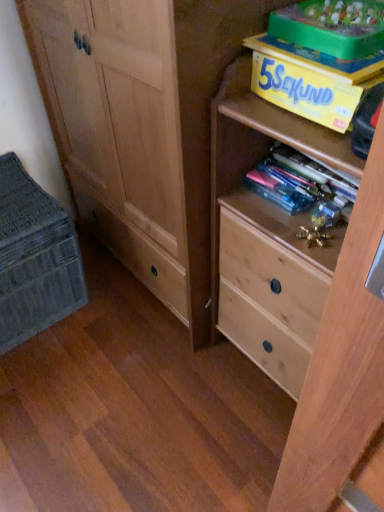
Find the location of a particular element. woven fabric basket at lower left is located at coordinates (34, 258).

Find the location of a particular element. translucent plastic books at center, which is counted as the 2th book, starting from the top is located at coordinates (303, 187).

The height and width of the screenshot is (512, 384). What do you see at coordinates (318, 59) in the screenshot?
I see `yellow cardboard box at upper right, acting as the first book starting from the top` at bounding box center [318, 59].

This screenshot has width=384, height=512. Identify the location of light wood chest of drawers at right. (301, 298).

Locate an element on the screen. The height and width of the screenshot is (512, 384). woven fabric basket at lower left is located at coordinates (34, 258).

How distant is yellow cardboard box at upper right, acting as the first book starting from the top, from green plastic storage box at upper right?

A distance of 1.88 inches exists between yellow cardboard box at upper right, acting as the first book starting from the top, and green plastic storage box at upper right.

Between yellow cardboard box at upper right, which is the 2th book from bottom to top, and green plastic storage box at upper right, which one is positioned behind?

Positioned behind is yellow cardboard box at upper right, which is the 2th book from bottom to top.

Does yellow cardboard box at upper right, which is the 2th book from bottom to top, appear on the left side of green plastic storage box at upper right?

Incorrect, yellow cardboard box at upper right, which is the 2th book from bottom to top, is not on the left side of green plastic storage box at upper right.

Could green plastic storage box at upper right be considered to be inside yellow cardboard box at upper right, which is the 2th book from bottom to top?

No, green plastic storage box at upper right is not a part of yellow cardboard box at upper right, which is the 2th book from bottom to top.

Which object is positioned more to the left, yellow cardboard box at upper right, which is the 2th book from bottom to top, or woven fabric basket at lower left?

Positioned to the left is woven fabric basket at lower left.

Does yellow cardboard box at upper right, which is the 2th book from bottom to top, contain woven fabric basket at lower left?

Actually, woven fabric basket at lower left is outside yellow cardboard box at upper right, which is the 2th book from bottom to top.

Is yellow cardboard box at upper right, acting as the first book starting from the top, positioned before woven fabric basket at lower left?

Yes, it is.

Is yellow cardboard box at upper right, acting as the first book starting from the top, turned away from woven fabric basket at lower left?

yellow cardboard box at upper right, acting as the first book starting from the top, is not turned away from woven fabric basket at lower left.

From a real-world perspective, does green plastic storage box at upper right sit lower than woven fabric basket at lower left?

No, from a real-world perspective, green plastic storage box at upper right is not below woven fabric basket at lower left.

How much distance is there between green plastic storage box at upper right and woven fabric basket at lower left?

green plastic storage box at upper right and woven fabric basket at lower left are 38.30 inches apart.

How different are the orientations of green plastic storage box at upper right and woven fabric basket at lower left in degrees?

green plastic storage box at upper right and woven fabric basket at lower left are facing 89.8 degrees away from each other.

Is green plastic storage box at upper right far from woven fabric basket at lower left?

No, there isn't a large distance between green plastic storage box at upper right and woven fabric basket at lower left.

Which is nearer, (332, 24) or (335, 450)?

The point (335, 450) is more forward.

Is green plastic storage box at upper right touching light wood chest of drawers at right?

No, green plastic storage box at upper right is not in contact with light wood chest of drawers at right.

From the image's perspective, which object appears higher, green plastic storage box at upper right or light wood chest of drawers at right?

green plastic storage box at upper right, from the image's perspective.

From a real-world perspective, is green plastic storage box at upper right physically above light wood chest of drawers at right?

Yes, from a real-world perspective, green plastic storage box at upper right is over light wood chest of drawers at right

How many degrees apart are the facing directions of light wood chest of drawers at right and green plastic storage box at upper right?

The angle between the facing direction of light wood chest of drawers at right and the facing direction of green plastic storage box at upper right is 0.9 degrees.

Looking at this image, considering the positions of objects light wood chest of drawers at right and green plastic storage box at upper right in the image provided, who is in front, light wood chest of drawers at right or green plastic storage box at upper right?

light wood chest of drawers at right is closer to the camera.

Who is bigger, light wood chest of drawers at right or green plastic storage box at upper right?

light wood chest of drawers at right.

Looking at their sizes, would you say light wood chest of drawers at right is wider or thinner than green plastic storage box at upper right?

light wood chest of drawers at right is wider than green plastic storage box at upper right.

Is green plastic storage box at upper right to the left of yellow cardboard box at upper right, acting as the first book starting from the top, from the viewer's perspective?

Yes, green plastic storage box at upper right is to the left of yellow cardboard box at upper right, acting as the first book starting from the top.

Between green plastic storage box at upper right and yellow cardboard box at upper right, which is the 2th book from bottom to top, which one has larger size?

With larger size is green plastic storage box at upper right.

In the scene shown: Would you say green plastic storage box at upper right is a long distance from yellow cardboard box at upper right, acting as the first book starting from the top?

green plastic storage box at upper right is near yellow cardboard box at upper right, acting as the first book starting from the top, not far away.

Does green plastic storage box at upper right turn towards yellow cardboard box at upper right, acting as the first book starting from the top?

No, green plastic storage box at upper right is not turned towards yellow cardboard box at upper right, acting as the first book starting from the top.

Is translucent plastic books at center, placed as the 1th book when sorted from bottom to top, facing towards light wood chest of drawers at right?

Yes, translucent plastic books at center, placed as the 1th book when sorted from bottom to top, is oriented towards light wood chest of drawers at right.

From a real-world perspective, which object stands above the other?

From a 3D spatial view, translucent plastic books at center, placed as the 1th book when sorted from bottom to top, is above.

From the picture: Are translucent plastic books at center, which is counted as the 2th book, starting from the top, and light wood chest of drawers at right far apart?

No, there isn't a large distance between translucent plastic books at center, which is counted as the 2th book, starting from the top, and light wood chest of drawers at right.

Is translucent plastic books at center, which is counted as the 2th book, starting from the top, surrounding light wood chest of drawers at right?

That's incorrect, light wood chest of drawers at right is not inside translucent plastic books at center, which is counted as the 2th book, starting from the top.

What are the coordinates of `book on the right of green plastic storage box at upper right` in the screenshot? It's located at (318, 59).

Image resolution: width=384 pixels, height=512 pixels. I want to click on the 2nd book in front of the woven fabric basket at lower left, so click(x=318, y=59).

Considering their positions, is translucent plastic books at center, which is counted as the 2th book, starting from the top, positioned closer to woven fabric basket at lower left than green plastic storage box at upper right?

Based on the image, translucent plastic books at center, which is counted as the 2th book, starting from the top, appears to be nearer to woven fabric basket at lower left.

Estimate the real-world distances between objects in this image. Which object is further from green plastic storage box at upper right, yellow cardboard box at upper right, which is the 2th book from bottom to top, or woven fabric basket at lower left?

woven fabric basket at lower left.

Based on their spatial positions, is light wood chest of drawers at right or green plastic storage box at upper right further from yellow cardboard box at upper right, acting as the first book starting from the top?

Based on the image, light wood chest of drawers at right appears to be further to yellow cardboard box at upper right, acting as the first book starting from the top.

Which object lies nearer to the anchor point translucent plastic books at center, which is counted as the 2th book, starting from the top, woven fabric basket at lower left or light wood chest of drawers at right?

Based on the image, light wood chest of drawers at right appears to be nearer to translucent plastic books at center, which is counted as the 2th book, starting from the top.

Based on their spatial positions, is woven fabric basket at lower left or translucent plastic books at center, which is counted as the 2th book, starting from the top, further from yellow cardboard box at upper right, which is the 2th book from bottom to top?

woven fabric basket at lower left is further to yellow cardboard box at upper right, which is the 2th book from bottom to top.

Based on their spatial positions, is yellow cardboard box at upper right, acting as the first book starting from the top, or green plastic storage box at upper right closer to woven fabric basket at lower left?

yellow cardboard box at upper right, acting as the first book starting from the top, is closer to woven fabric basket at lower left.

Based on their spatial positions, is green plastic storage box at upper right or translucent plastic books at center, which is counted as the 2th book, starting from the top, further from yellow cardboard box at upper right, which is the 2th book from bottom to top?

translucent plastic books at center, which is counted as the 2th book, starting from the top, is positioned further to the anchor yellow cardboard box at upper right, which is the 2th book from bottom to top.

Consider the image. From the image, which object appears to be farther from translucent plastic books at center, placed as the 1th book when sorted from bottom to top, green plastic storage box at upper right or light wood chest of drawers at right?

green plastic storage box at upper right.

Find the location of `book between green plastic storage box at upper right and translucent plastic books at center, which is counted as the 2th book, starting from the top, vertically`. book between green plastic storage box at upper right and translucent plastic books at center, which is counted as the 2th book, starting from the top, vertically is located at coordinates (318, 59).

Identify the location of book between woven fabric basket at lower left and green plastic storage box at upper right. The image size is (384, 512). (303, 187).

What are the coordinates of `storage box between woven fabric basket at lower left and light wood chest of drawers at right from left to right` in the screenshot? It's located at (332, 26).

Find the location of a particular element. This screenshot has width=384, height=512. book situated between woven fabric basket at lower left and yellow cardboard box at upper right, acting as the first book starting from the top, from left to right is located at coordinates (303, 187).